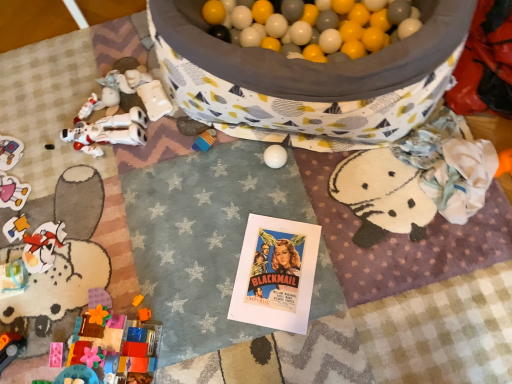
Locate an element on the screen. free space in front of plastic toy car at lower left, the 1th toy positioned from the back is located at coordinates (20, 201).